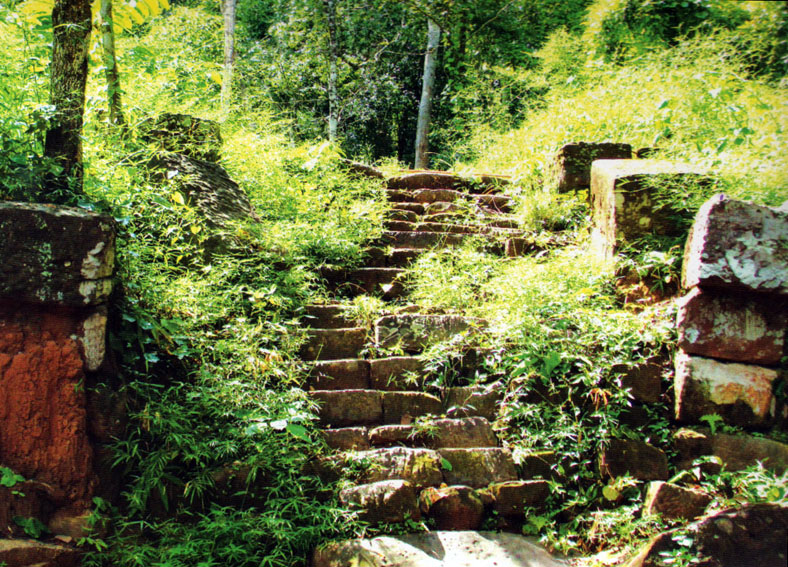
Find the location of a particular element. landing is located at coordinates (471, 550).